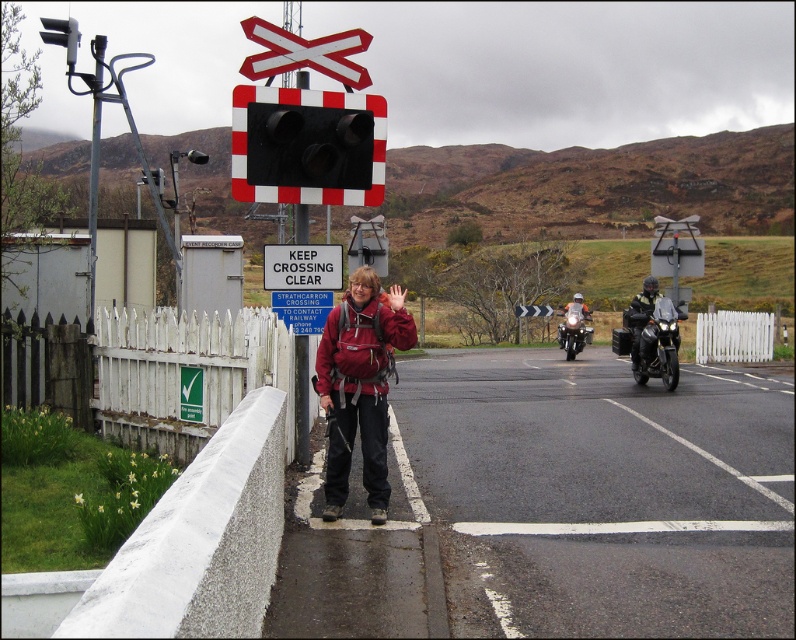
Question: Observing the image, what is the correct spatial positioning of matte red jacket at center in reference to white plastic sign at center?

Choices:
 (A) left
 (B) right

Answer: (B)

Question: Which object is the closest to the black matte traffic light at center?

Choices:
 (A) shiny chrome motorcycle at center
 (B) matte red jacket at center

Answer: (B)

Question: Can you confirm if white plastic sign at upper center is positioned below shiny chrome motorcycle at center?

Choices:
 (A) yes
 (B) no

Answer: (B)

Question: Which of the following is the closest to the observer?

Choices:
 (A) shiny black motorcycle at center-right
 (B) white plastic sign at center
 (C) matte red jacket at center

Answer: (C)

Question: Is matte red jacket at center thinner than shiny chrome motorcycle at center?

Choices:
 (A) no
 (B) yes

Answer: (B)

Question: Which object is farther from the camera taking this photo?

Choices:
 (A) shiny chrome motorcycle at center
 (B) black matte traffic light at center

Answer: (A)